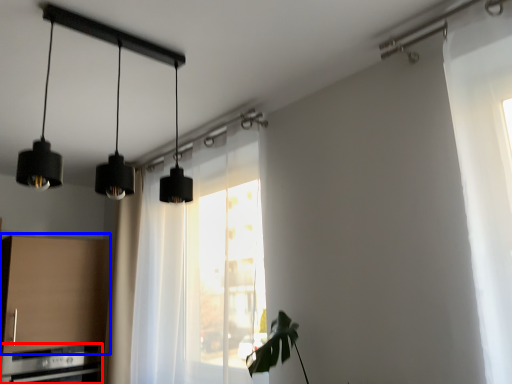
Question: Among these objects, which one is farthest to the camera, appliance (highlighted by a red box) or cabinetry (highlighted by a blue box)?

Choices:
 (A) appliance
 (B) cabinetry

Answer: (B)